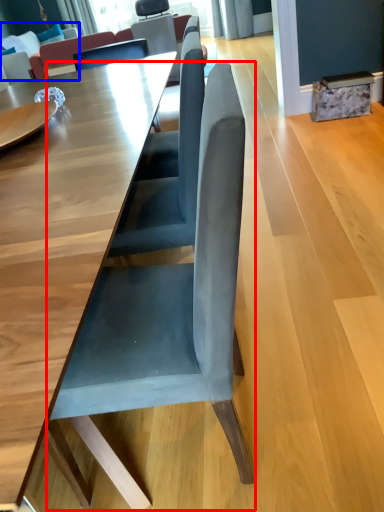
Question: Which point is closer to the camera, chair (highlighted by a red box) or couch (highlighted by a blue box)?

Choices:
 (A) chair
 (B) couch

Answer: (A)